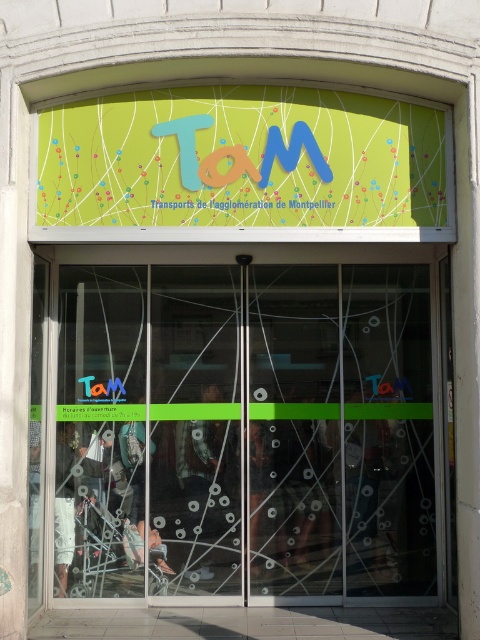
You are a delivery person with a large box that is 2 meters wide. You need to enter the TaM transportation hub through the entrance shown. Can your box fit through the transparent glass doors at center if the matte green signboard at upper center is 1.5 meters wide?

The transparent glass doors at center are wider than the matte green signboard at upper center, which is 1.5 meters wide. Since the doors are wider than 1.5 meters, the 2 meter wide box may fit, but you should check the exact door width before attempting to pass through.

You are a delivery person arriving at the entrance of the TaM transportation hub. You need to determine the best way to carry a large package through the entrance. The transparent glass doors at center and the matte green signboard at upper center are visible. Which object is bigger in size, and why does that matter for carrying your package?

The transparent glass doors at center are larger in size than the matte green signboard at upper center. This matters because the larger size of the transparent glass doors at center provides a wider and taller opening, making it easier to maneuver a large package through the entrance without needing to adjust its position significantly.

You are standing at the entrance of the TaM transportation hub. You need to walk through the transparent glass doors at center to enter. As you approach, you notice the matte green signboard at upper center above the doors. Which object will you encounter first as you move forward toward the doors?

You will encounter the transparent glass doors at center first because they are closer to you than the matte green signboard at upper center, which is positioned further back.